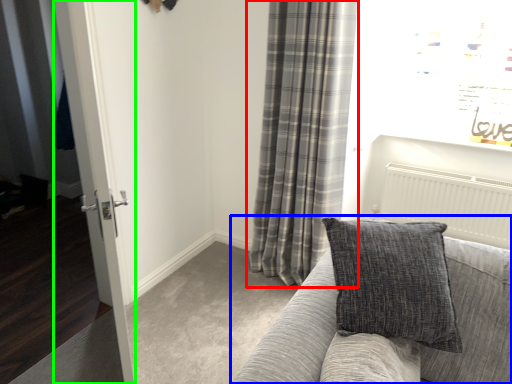
Question: Which object is positioned farthest from curtain (highlighted by a red box)? Select from studio couch (highlighted by a blue box) and glass door (highlighted by a green box).

Choices:
 (A) studio couch
 (B) glass door

Answer: (A)